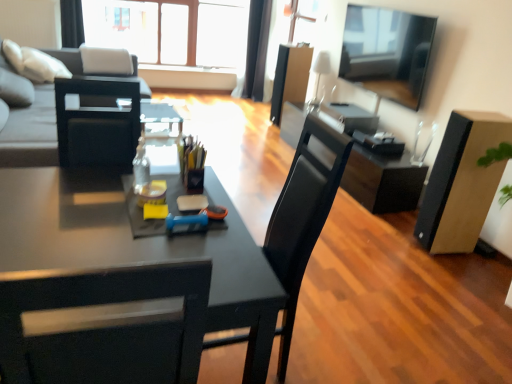
Question: Is flat screen tv at upper right in front of or behind gray fabric couch at upper left in the image?

Choices:
 (A) front
 (B) behind

Answer: (A)

Question: From their relative heights in the image, would you say flat screen tv at upper right is taller or shorter than gray fabric couch at upper left?

Choices:
 (A) tall
 (B) short

Answer: (B)

Question: Considering the real-world distances, which object is farthest from the white glossy lampshade at upper center?

Choices:
 (A) matte black chair at center
 (B) transparent glass window at upper center
 (C) gray fabric couch at upper left
 (D) black fabric curtain at upper left, marked as the second curtain in a right-to-left arrangement
 (E) matte black box at center, which appears as the 2th box when viewed from the right

Answer: (A)

Question: Which object is positioned closest to the flat screen tv at upper right?

Choices:
 (A) gray fabric couch at upper left
 (B) matte black chair at center
 (C) matte black box at center, which ranks as the 2th box in front-to-back order
 (D) matte black desk at center
 (E) black fabric curtain at upper center, marked as the second curtain in a left-to-right arrangement

Answer: (C)